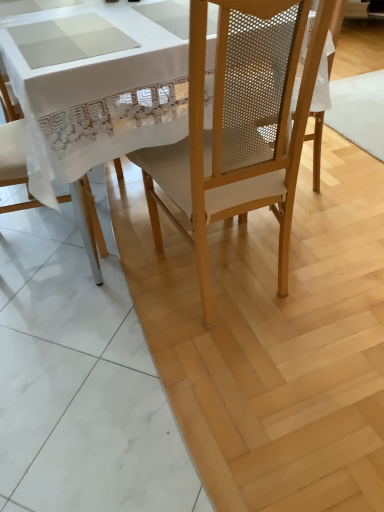
Question: Is point (155, 205) closer or farther from the camera than point (294, 329)?

Choices:
 (A) farther
 (B) closer

Answer: (A)

Question: From the image's perspective, is matte wood chair at center, the 1th chair when ordered from right to left, positioned above or below matte wood chair at center?

Choices:
 (A) below
 (B) above

Answer: (A)

Question: Based on their relative distances, which object is farther from the matte wood chair at center?

Choices:
 (A) matte wood chair at center, the 1th chair when ordered from right to left
 (B) white fabric chair at left, which ranks as the first chair in left-to-right order

Answer: (B)

Question: Estimate the real-world distances between objects in this image. Which object is farther from the matte wood chair at center?

Choices:
 (A) matte wood chair at center, which is counted as the second chair, starting from the left
 (B) white fabric chair at left, acting as the 2th chair starting from the right

Answer: (B)